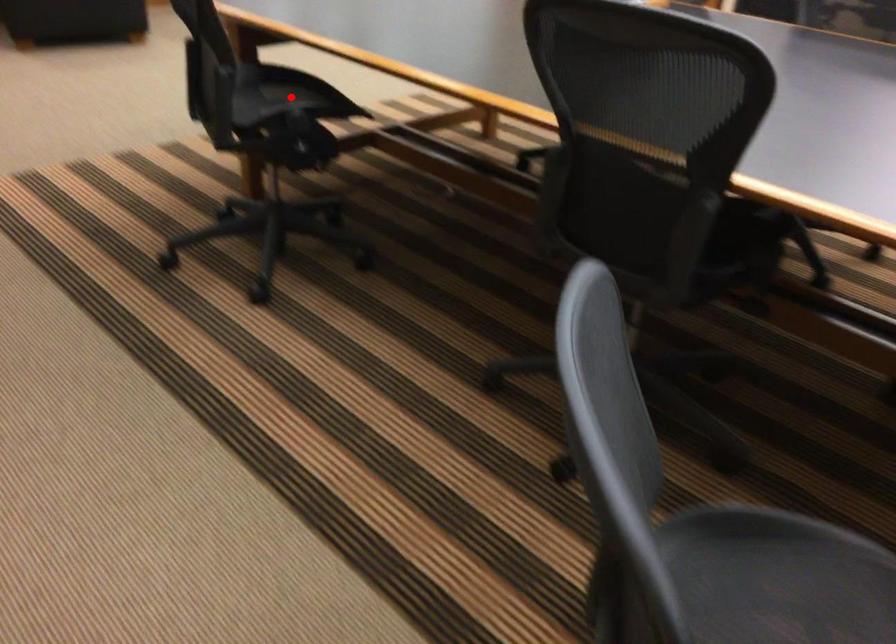
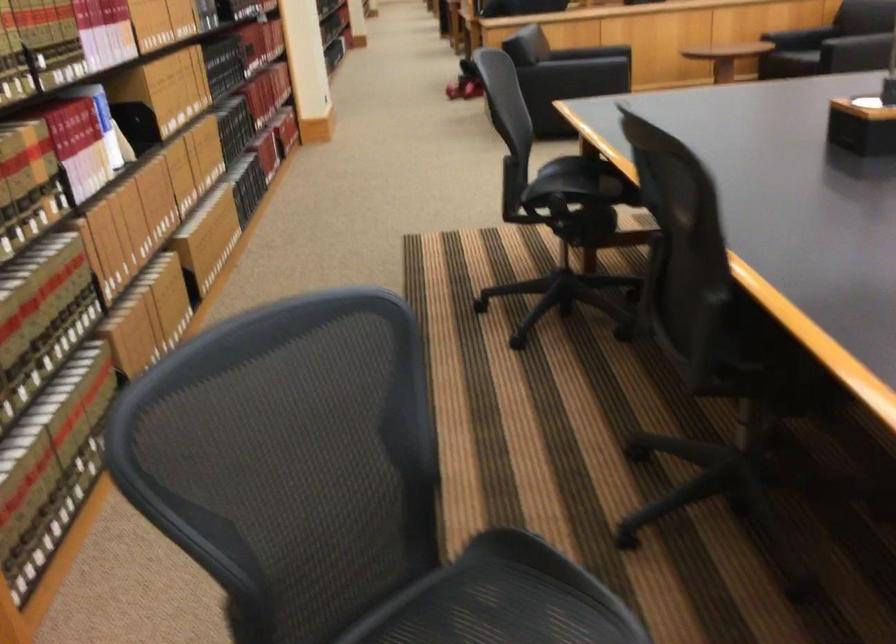
Find the pixel in the second image that matches the highlighted location in the first image.

(574, 182)